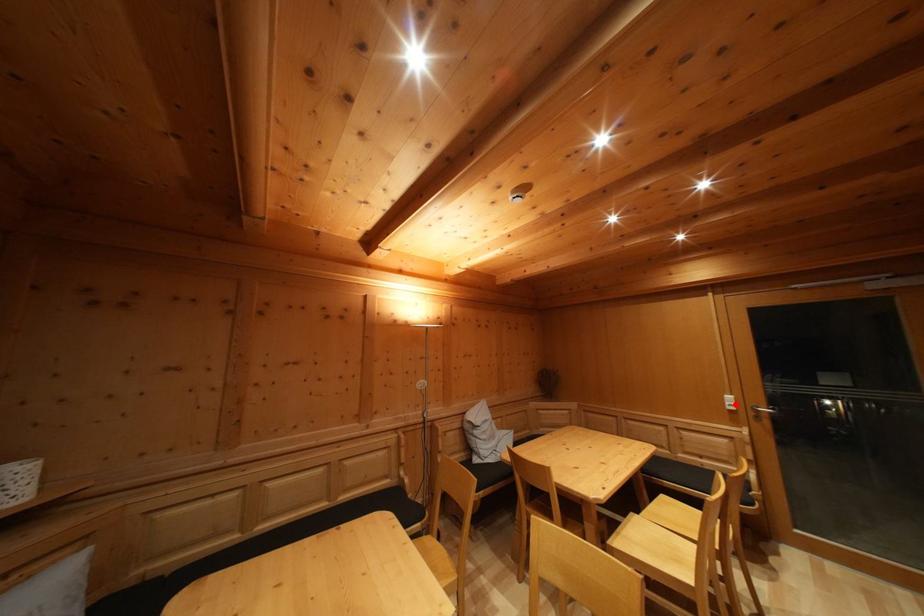
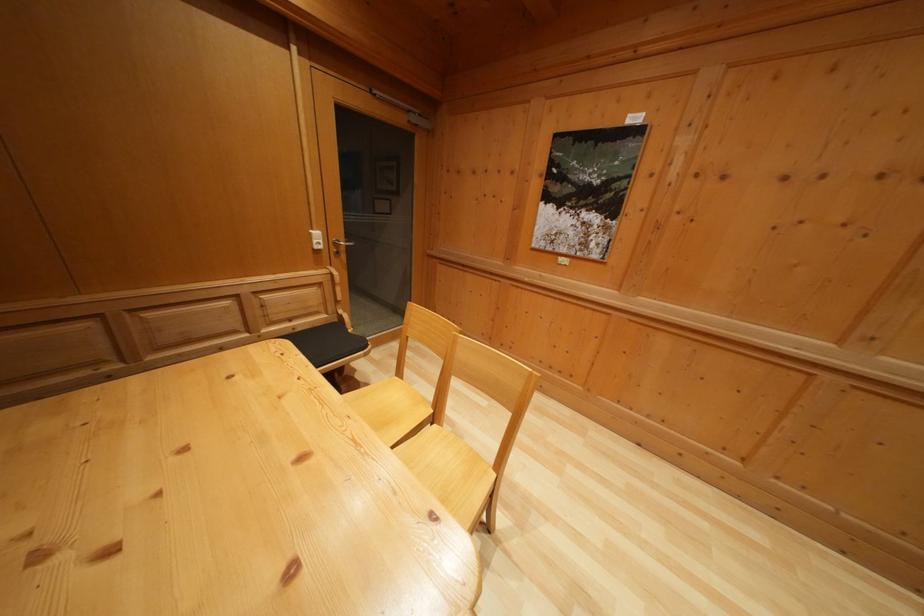
Locate, in the second image, the point that corresponds to the highlighted location in the first image.

(322, 240)